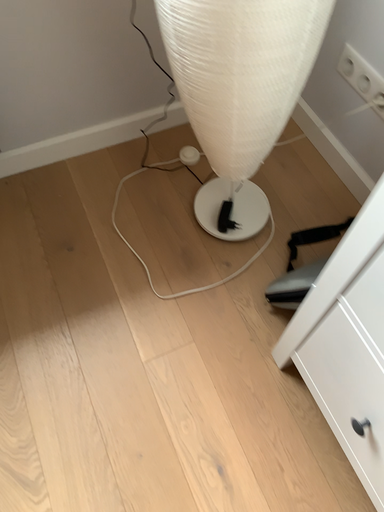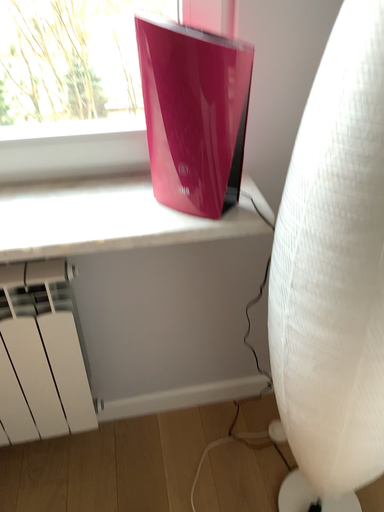
Question: How did the camera likely rotate when shooting the video?

Choices:
 (A) rotated upward
 (B) rotated downward

Answer: (A)